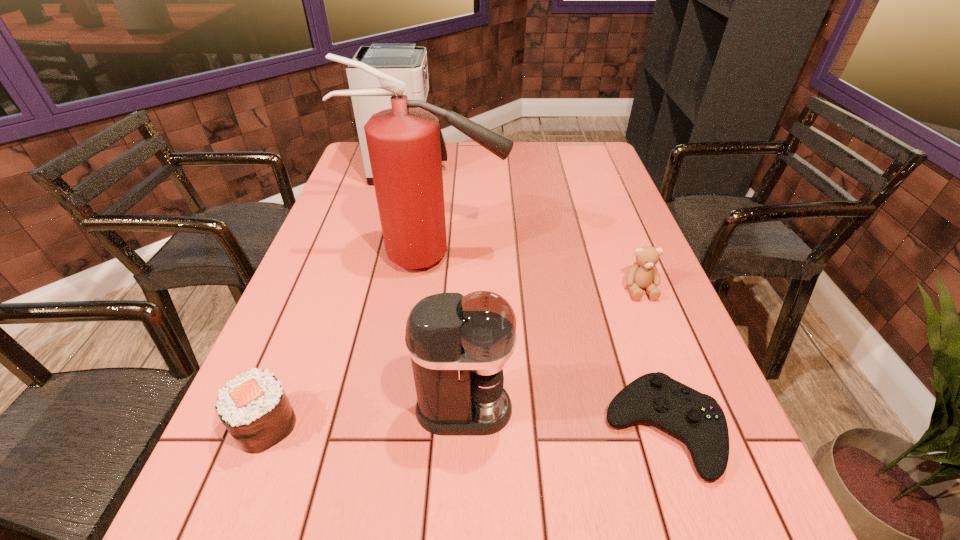
This screenshot has width=960, height=540. In order to click on control situated at the right edge in this screenshot , I will do `click(696, 419)`.

Find the location of a particular element. The image size is (960, 540). object that is at the far left corner is located at coordinates (406, 61).

Find the location of `vacant space at the far edge of the desktop`. vacant space at the far edge of the desktop is located at coordinates (475, 147).

The width and height of the screenshot is (960, 540). Find the location of `vacant area at the near edge`. vacant area at the near edge is located at coordinates (331, 525).

Locate an element on the screen. The image size is (960, 540). vacant space at the left edge of the desktop is located at coordinates (324, 316).

Locate an element on the screen. Image resolution: width=960 pixels, height=540 pixels. free space at the right edge of the desktop is located at coordinates (601, 187).

Where is `free space at the far right corner of the desktop`? This screenshot has height=540, width=960. free space at the far right corner of the desktop is located at coordinates (598, 150).

You are a GUI agent. You are given a task and a screenshot of the screen. Output one action in this format:
    pyautogui.click(x=<x>, y=<y>)
    Task: Click on the free space that is in between the farther coffee maker and the teddy bear
    The image size is (960, 540).
    Given the screenshot: What is the action you would take?
    pyautogui.click(x=525, y=230)

Locate an element on the screen. The image size is (960, 540). free area in between the sushi and the fire extinguisher is located at coordinates (350, 341).

This screenshot has height=540, width=960. What are the coordinates of `vacant area that lies between the tallest object and the sushi` in the screenshot? It's located at (350, 341).